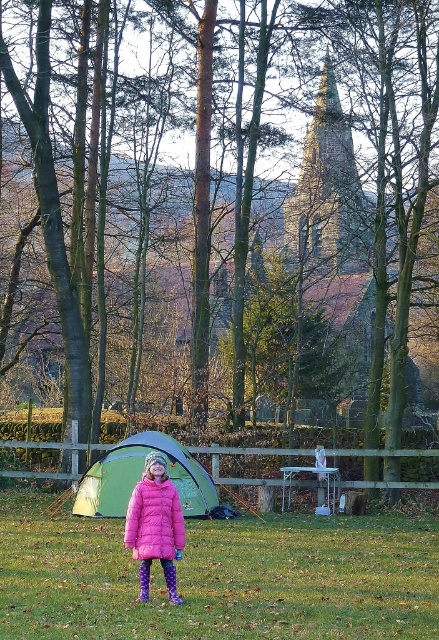
Question: Does green fabric tent at center lie in front of purple fabric boot at lower center?

Choices:
 (A) no
 (B) yes

Answer: (A)

Question: From the image, what is the correct spatial relationship of green grass at center in relation to purple fabric boot at lower center?

Choices:
 (A) below
 (B) above

Answer: (A)

Question: Which of the following is the closest to the observer?

Choices:
 (A) (147, 547)
 (B) (411, 577)
 (C) (164, 576)
 (D) (122, 458)

Answer: (A)

Question: Can you confirm if green grass at center is bigger than green fabric tent at center?

Choices:
 (A) no
 (B) yes

Answer: (B)

Question: Estimate the real-world distances between objects in this image. Which object is closer to the pink down jacket at center?

Choices:
 (A) purple fabric boot at lower center
 (B) green grass at center

Answer: (A)

Question: Which point appears farthest from the camera in this image?

Choices:
 (A) (165, 561)
 (B) (15, 620)

Answer: (A)